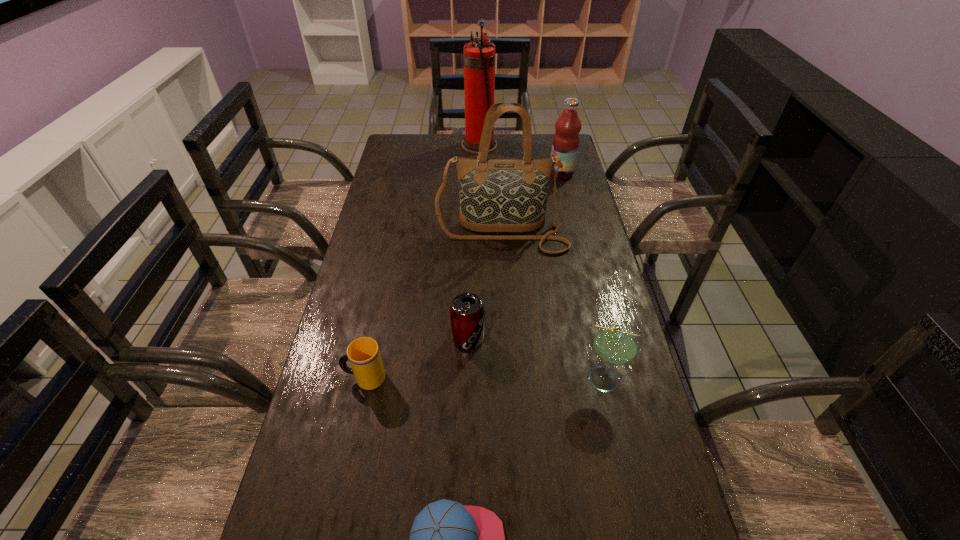
Find the location of `fruit juice at the right edge`. fruit juice at the right edge is located at coordinates (565, 144).

Where is `martini at the right edge`? martini at the right edge is located at coordinates (615, 344).

I want to click on vacant position at the far edge of the desktop, so click(x=509, y=154).

Identify the location of blank space at the left edge of the desktop. This screenshot has width=960, height=540. (387, 187).

In the image, there is a desktop. Identify the location of vacant space at the right edge. (568, 335).

Where is `vacant space at the far left corner of the desktop`? vacant space at the far left corner of the desktop is located at coordinates (410, 158).

Identify the location of unoccupied position between the martini and the second farthest object. (585, 276).

This screenshot has height=540, width=960. Identify the location of free area in between the martini and the third tallest object. tap(585, 276).

Where is `vacant point located between the fifth nearest object and the fourth nearest object`? Image resolution: width=960 pixels, height=540 pixels. vacant point located between the fifth nearest object and the fourth nearest object is located at coordinates (485, 286).

Choose which object is the second nearest neighbor to the fire extinguisher. Please provide its 2D coordinates. Your answer should be formatted as a tuple, i.e. [(x, y)], where the tuple contains the x and y coordinates of a point satisfying the conditions above.

[(495, 195)]